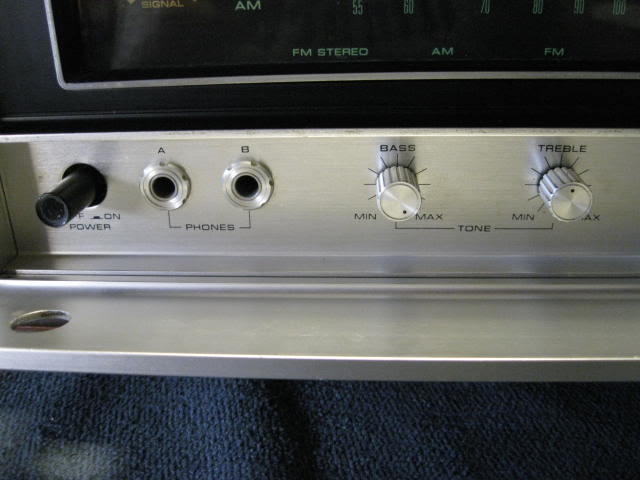
Where is `screen`? This screenshot has height=480, width=640. screen is located at coordinates (228, 35).